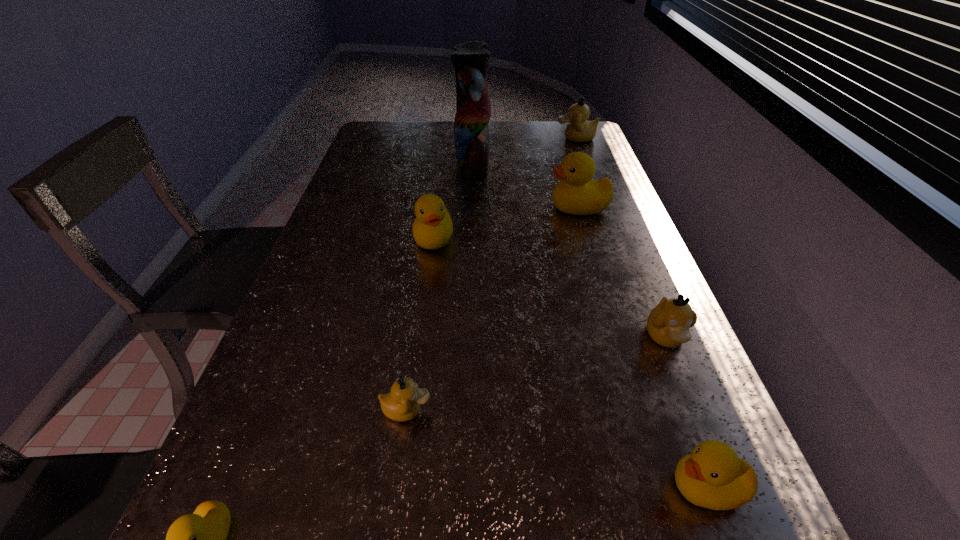
Where is `vacant space situated on the face of the second biggest tan duckling`? This screenshot has height=540, width=960. vacant space situated on the face of the second biggest tan duckling is located at coordinates (714, 459).

At what (x,y) coordinates should I click in order to perform the action: click on vacant space located on the face of the third biggest yellow duckling. Please return your answer as a coordinate pair (x, y). Image resolution: width=960 pixels, height=540 pixels. Looking at the image, I should click on (489, 487).

Locate an element on the screen. The image size is (960, 540). free space located on the face of the third biggest yellow duckling is located at coordinates (578, 487).

Where is `vacant space situated 0.340m on the face of the third biggest yellow duckling`? vacant space situated 0.340m on the face of the third biggest yellow duckling is located at coordinates (450, 487).

The image size is (960, 540). What are the coordinates of `blank space located on the face of the leftmost tan duckling` in the screenshot? It's located at (654, 410).

Locate an element on the screen. The height and width of the screenshot is (540, 960). parrot at the far edge is located at coordinates (470, 59).

The width and height of the screenshot is (960, 540). Find the location of `duckling present at the far edge`. duckling present at the far edge is located at coordinates (579, 129).

At what (x,y) coordinates should I click in order to perform the action: click on object present at the far right corner. Please return your answer as a coordinate pair (x, y). Looking at the image, I should click on pyautogui.click(x=579, y=129).

This screenshot has width=960, height=540. Identify the location of free region at the far edge of the desktop. (492, 139).

This screenshot has width=960, height=540. What are the coordinates of `vacant space at the left edge` in the screenshot? It's located at (366, 174).